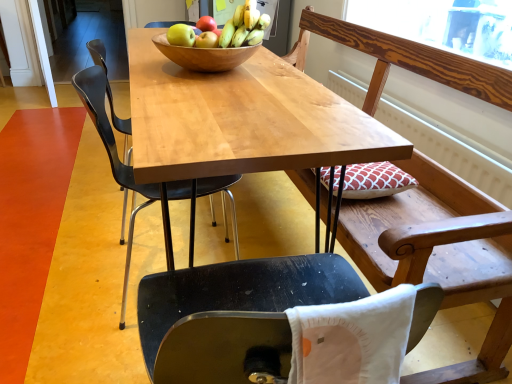
At what (x,y) coordinates should I click in order to perform the action: click on vacant region to the left of wooden bench at upper right. Please return your answer as a coordinate pair (x, y). Image resolution: width=512 pixels, height=384 pixels. Looking at the image, I should click on (64, 218).